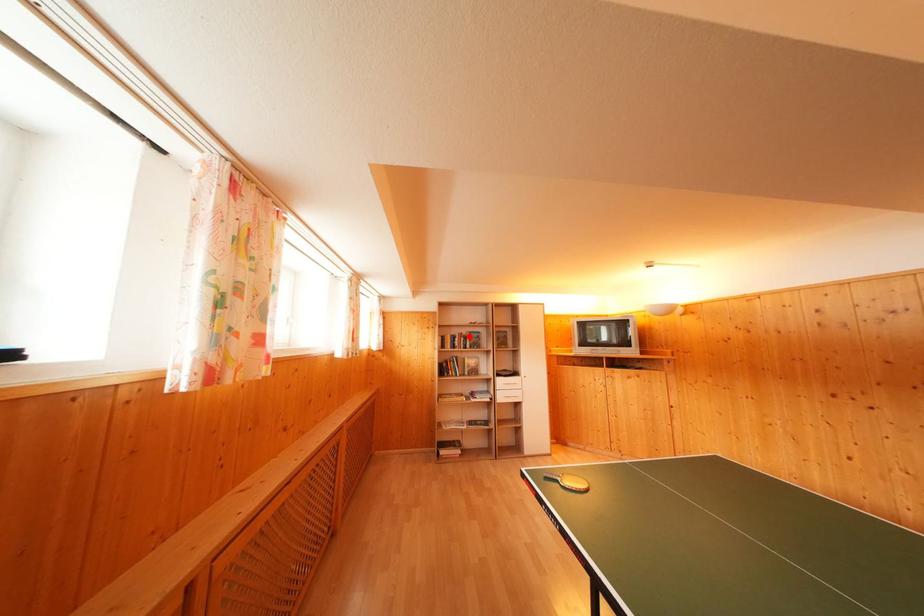
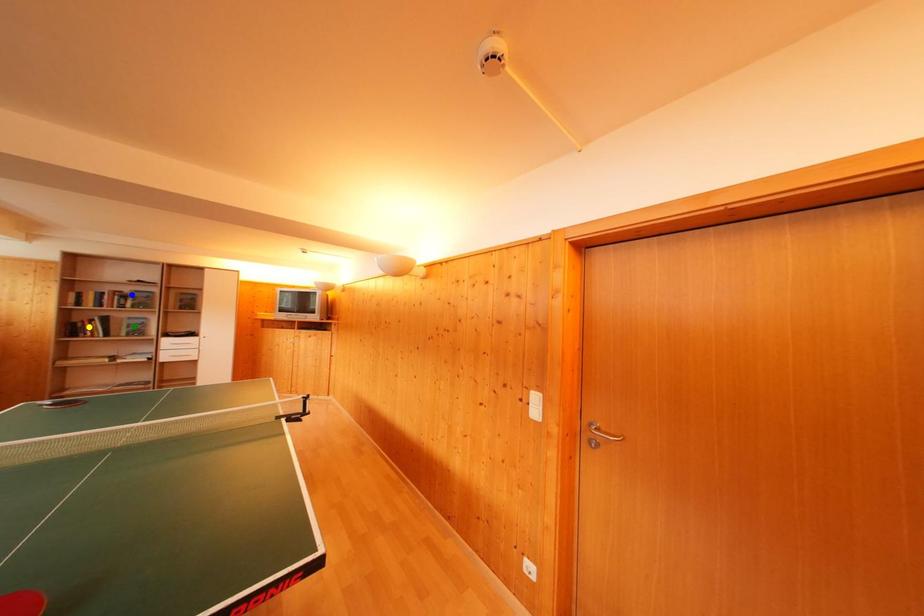
Question: I am providing you with two images of the same scene from different viewpoints. A red point is marked on the first image. You are given multiple points on the second image. Which spot in image 2 lines up with the point in image 1?

Choices:
 (A) green point
 (B) blue point
 (C) yellow point

Answer: (B)